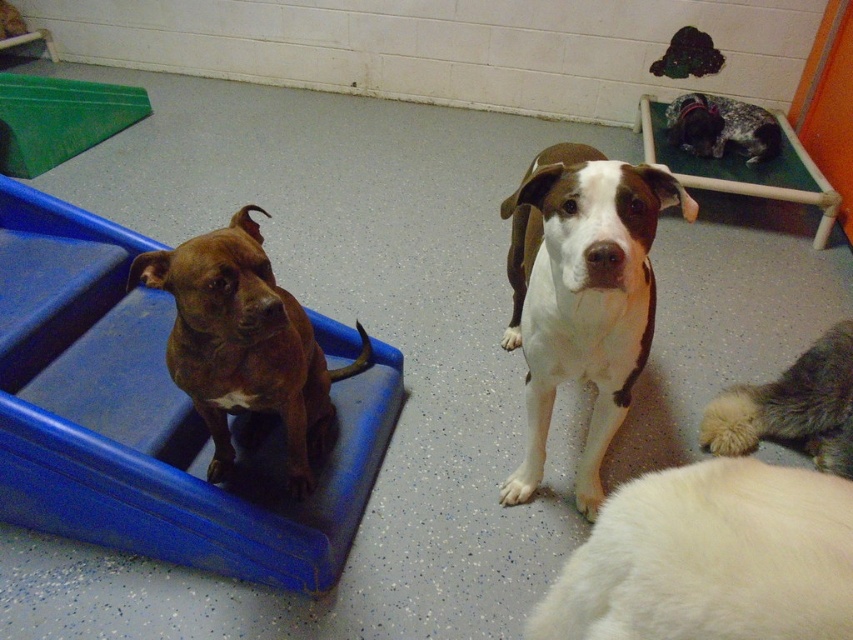
Question: Is white smooth dog at center bigger than brown glossy dog at left?

Choices:
 (A) yes
 (B) no

Answer: (A)

Question: Among these points, which one is nearest to the camera?

Choices:
 (A) (540, 240)
 (B) (753, 442)

Answer: (A)

Question: In this image, where is white smooth dog at center located relative to spotted fur bed at upper right?

Choices:
 (A) below
 (B) above

Answer: (A)

Question: Can you confirm if brown glossy dog at left is bigger than fluffy white cat at lower right?

Choices:
 (A) yes
 (B) no

Answer: (A)

Question: Which object is the closest to the brown glossy dog at left?

Choices:
 (A) white smooth dog at center
 (B) spotted fur bed at upper right

Answer: (A)

Question: Which object is the closest to the brown glossy dog at left?

Choices:
 (A) spotted fur bed at upper right
 (B) fluffy white cat at lower right
 (C) white smooth dog at center

Answer: (C)